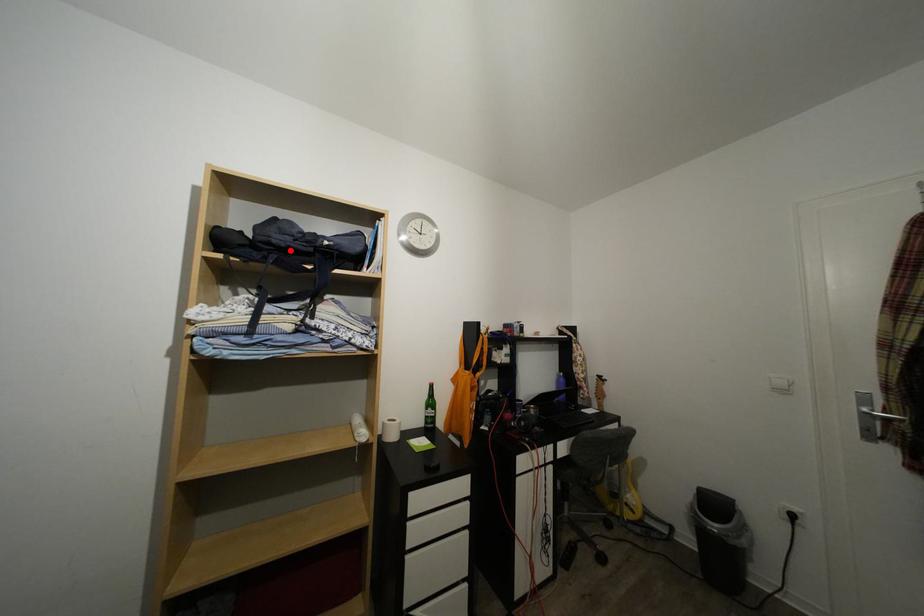
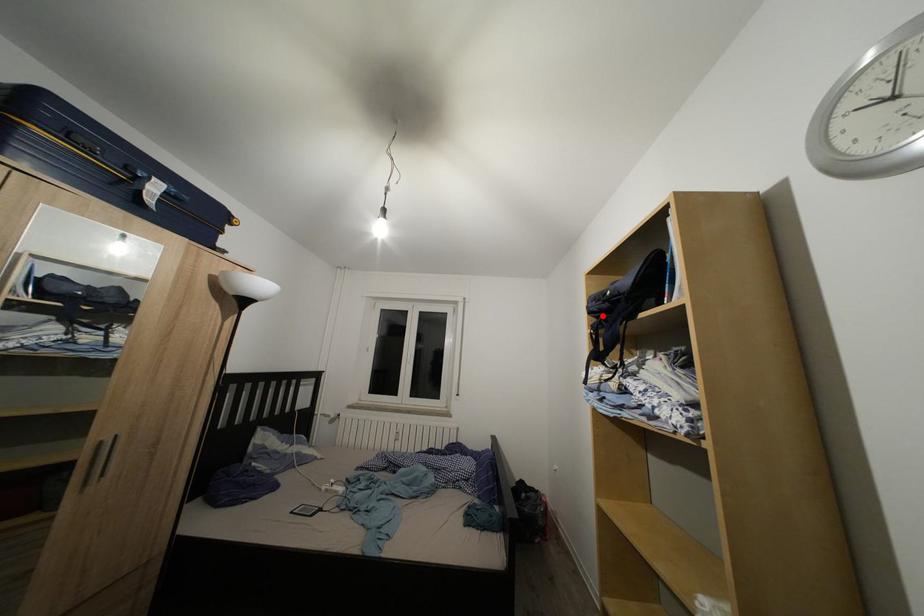
I am providing you with two images of the same scene from different viewpoints. A red point is marked on the first image and another point is marked on the second image. Do the highlighted points in image1 and image2 indicate the same real-world spot?

Yes